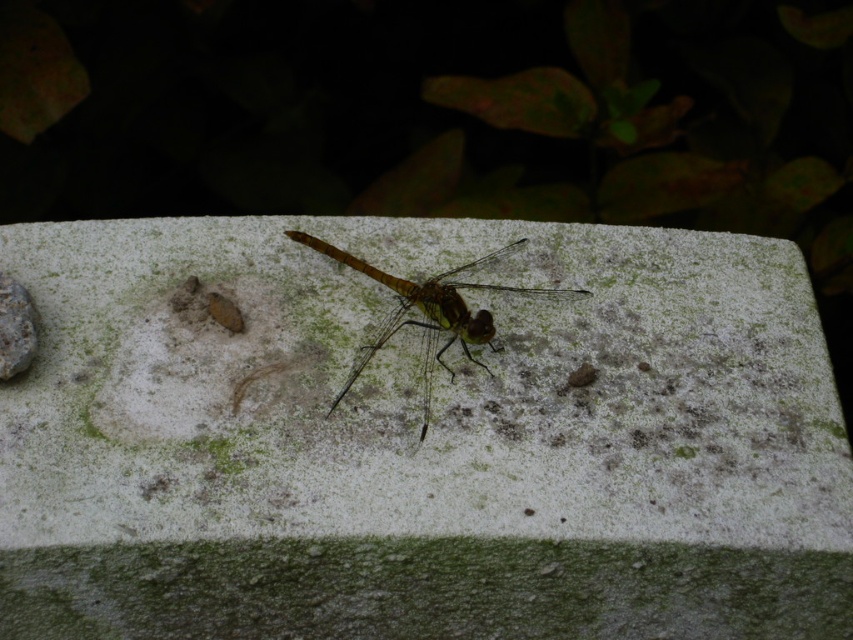
You are observing the dragonfly and the textured surface. There are two points marked on the image. Which point is closer to the dragonfly? Please choose between point A at point (648, 275) and point B at point (399, 326).

Point B at point (399, 326) is closer to the dragonfly because point A at point (648, 275) is behind it.

You are a photographer trying to capture the dragonfly on the stone block. You notice a point at coordinates [421,444]. Based on the scene description, what is the color and texture of the surface at this point?

The surface at point [421,444] is white rough concrete at center, so it would be white in color and have a rough texture.